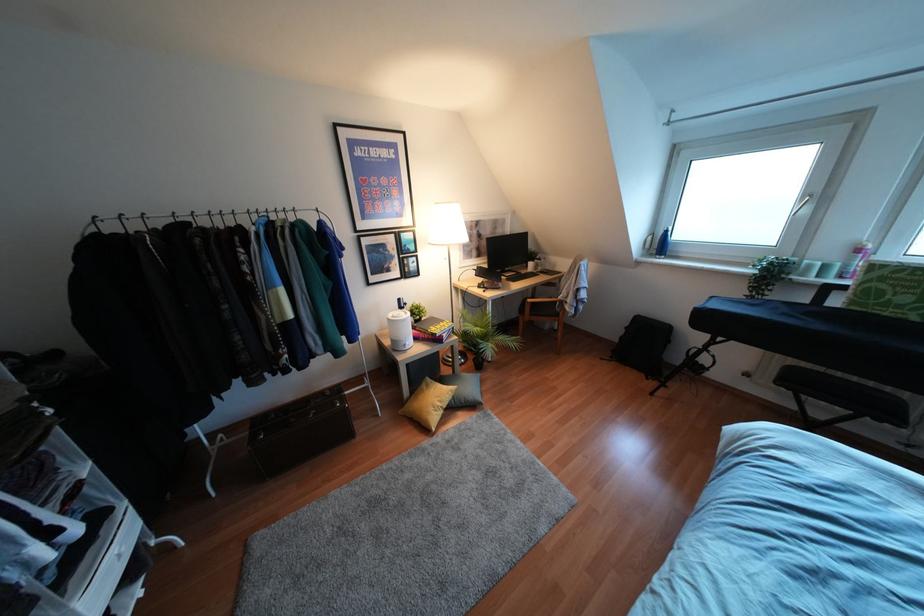
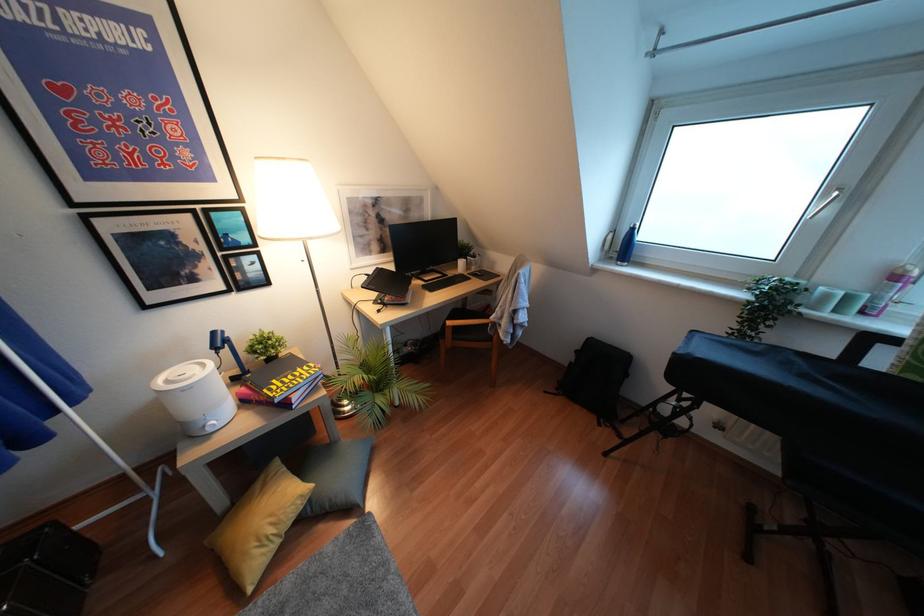
In the second image, find the point that corresponds to [660,245] in the first image.

(623, 246)